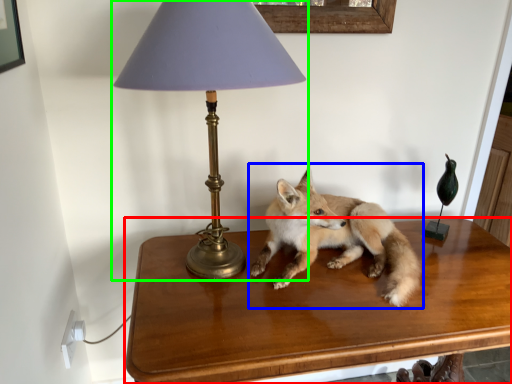
Question: Considering the real-world distances, which object is farthest from table (highlighted by a red box)? fox (highlighted by a blue box) or lamp (highlighted by a green box)?

Choices:
 (A) fox
 (B) lamp

Answer: (B)